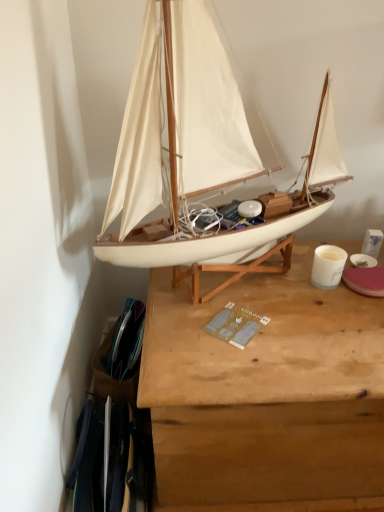
Question: From a real-world perspective, is white matte sailboat at center beneath wooden desk at center?

Choices:
 (A) yes
 (B) no

Answer: (B)

Question: Is white matte sailboat at center closer to the viewer compared to wooden desk at center?

Choices:
 (A) no
 (B) yes

Answer: (B)

Question: Is white matte sailboat at center wider than wooden desk at center?

Choices:
 (A) yes
 (B) no

Answer: (B)

Question: Does white matte sailboat at center touch wooden desk at center?

Choices:
 (A) yes
 (B) no

Answer: (B)

Question: Does white matte sailboat at center have a lesser height compared to wooden desk at center?

Choices:
 (A) yes
 (B) no

Answer: (B)

Question: Is white matte sailboat at center further to camera compared to wooden desk at center?

Choices:
 (A) no
 (B) yes

Answer: (A)

Question: Is the depth of wooden desk at center greater than that of white matte sailboat at center?

Choices:
 (A) no
 (B) yes

Answer: (B)

Question: From the image's perspective, does wooden desk at center appear lower than white matte sailboat at center?

Choices:
 (A) yes
 (B) no

Answer: (A)

Question: Could you tell me if wooden desk at center is facing white matte sailboat at center?

Choices:
 (A) yes
 (B) no

Answer: (B)

Question: Is wooden desk at center thinner than white matte sailboat at center?

Choices:
 (A) yes
 (B) no

Answer: (B)

Question: Considering the relative positions of wooden desk at center and white matte sailboat at center in the image provided, is wooden desk at center to the left of white matte sailboat at center from the viewer's perspective?

Choices:
 (A) yes
 (B) no

Answer: (B)

Question: Considering the relative positions of wooden desk at center and white matte sailboat at center in the image provided, is wooden desk at center to the right of white matte sailboat at center from the viewer's perspective?

Choices:
 (A) yes
 (B) no

Answer: (A)

Question: From the image's perspective, is white matte sailboat at center located above or below wooden desk at center?

Choices:
 (A) above
 (B) below

Answer: (A)